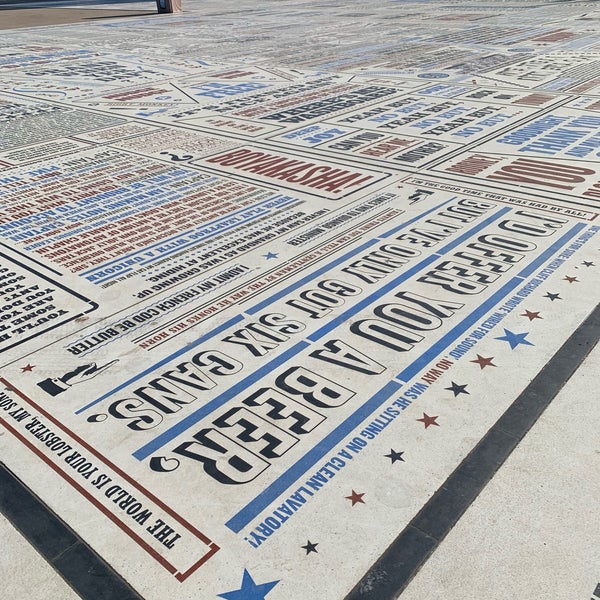
In order to click on carpet in this screenshot , I will do `click(427, 429)`.